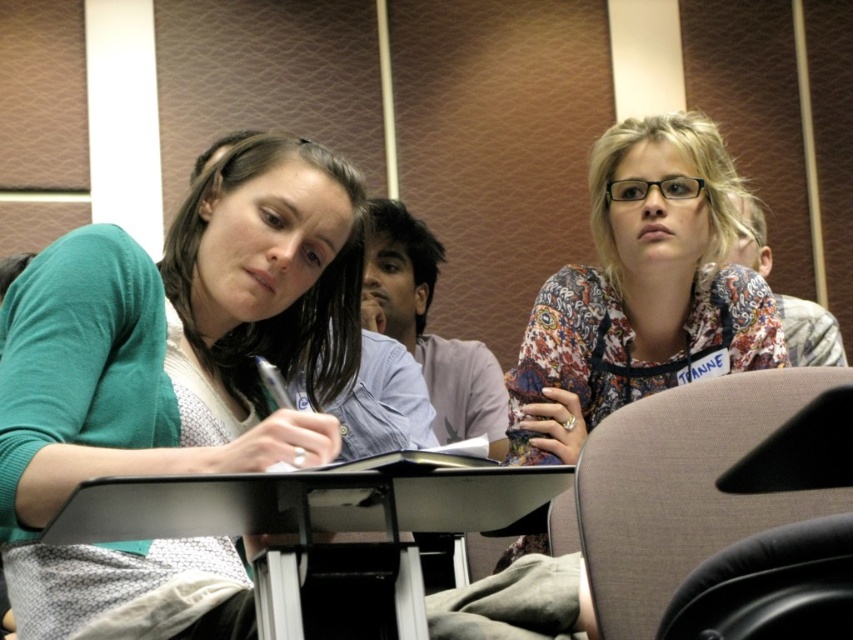
You are sitting in the black leather chair at lower right and want to reach the black plastic table at center to grab a pen. Is the table in front of or behind you?

The black leather chair at lower right is behind the black plastic table at center, so the table is in front of you.

You are a delivery robot in a conference room. You need to place a package on the floor between the floral fabric blouse at upper right and the brown fabric chair at lower right. Can you fit the package there if it measures 30 inches in length?

The distance between the floral fabric blouse at upper right and the brown fabric chair at lower right is 33.12 inches. Since the package is 30 inches long, it will fit with approximately 3.12 inches of space remaining.